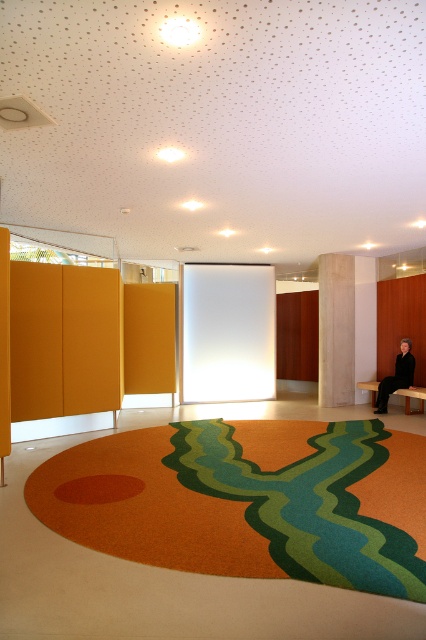
Question: Among these objects, which one is nearest to the camera?

Choices:
 (A) carpet at center
 (B) brown wooden bench at lower right
 (C) light brown wood pillar at right

Answer: (A)

Question: Is carpet at center closer to the viewer compared to light brown wood pillar at right?

Choices:
 (A) no
 (B) yes

Answer: (B)

Question: Which object is positioned farthest from the brown wooden bench at lower right?

Choices:
 (A) carpet at center
 (B) black leather bench at lower right
 (C) light brown wood pillar at right

Answer: (A)

Question: Does carpet at center have a lesser width compared to black leather bench at lower right?

Choices:
 (A) no
 (B) yes

Answer: (A)

Question: Which object is positioned farthest from the light brown wood pillar at right?

Choices:
 (A) carpet at center
 (B) brown wooden bench at lower right

Answer: (A)

Question: Does carpet at center have a greater width compared to brown wooden bench at lower right?

Choices:
 (A) yes
 (B) no

Answer: (A)